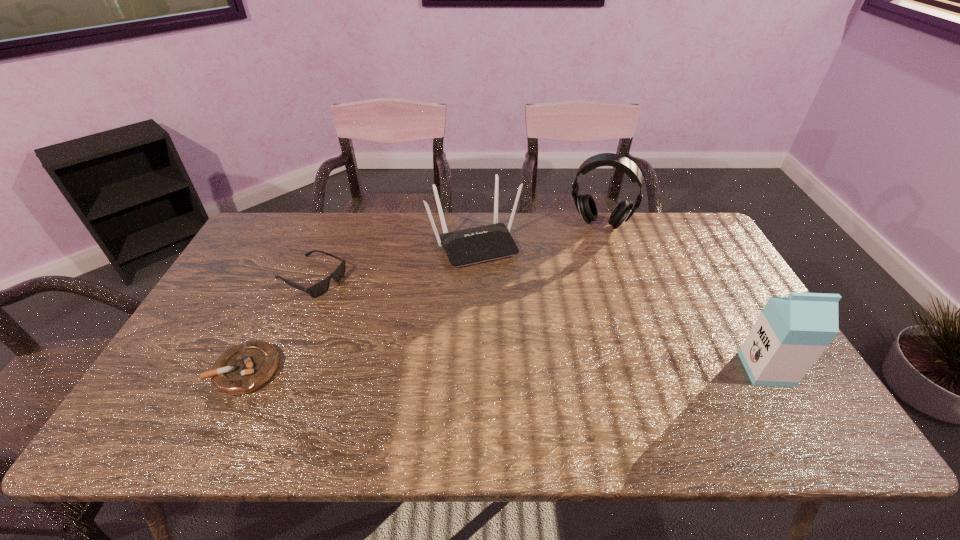
The image size is (960, 540). Identify the location of the shortest object. (244, 368).

Image resolution: width=960 pixels, height=540 pixels. Identify the location of milk carton. (790, 334).

You are a GUI agent. You are given a task and a screenshot of the screen. Output one action in this format:
    pyautogui.click(x=<x>, y=<y>)
    Task: Click on the third shortest object
    This screenshot has height=540, width=960.
    Given the screenshot: What is the action you would take?
    pyautogui.click(x=480, y=244)

Find the location of `the third object from right to left`. the third object from right to left is located at coordinates (480, 244).

Find the location of a particular element. earphone is located at coordinates (585, 204).

I want to click on sunglasses, so click(316, 290).

Locate an element on the screen. The height and width of the screenshot is (540, 960). free location located on the right of the shortest object is located at coordinates (360, 369).

The height and width of the screenshot is (540, 960). Identify the location of free point located 0.320m on the back of the rightmost object. (708, 270).

You are a GUI agent. You are given a task and a screenshot of the screen. Output one action in this format:
    pyautogui.click(x=<x>, y=<y>)
    Task: Click on the vacant space located on the front-facing side of the third shortest object
    Image resolution: width=960 pixels, height=540 pixels.
    Given the screenshot: What is the action you would take?
    pyautogui.click(x=515, y=316)

This screenshot has width=960, height=540. I want to click on vacant region located on the front-facing side of the third shortest object, so click(x=542, y=370).